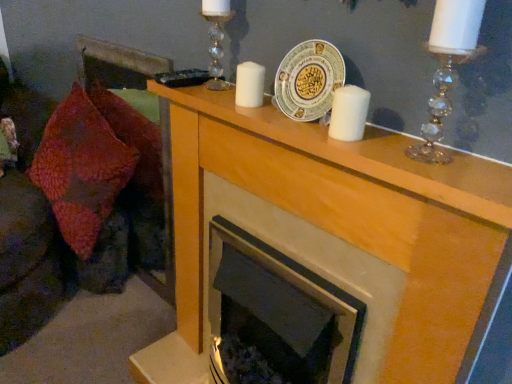
Question: Is white matte candle at center, the 2th candle positioned from the left, at the back of clear crystal candle holder at upper center, the 2th candle holder in the right-to-left sequence?

Choices:
 (A) no
 (B) yes

Answer: (A)

Question: From a real-world perspective, is clear crystal candle holder at upper center, acting as the 1th candle holder starting from the back, positioned over white matte candle at center, the 2th candle positioned from the left, based on gravity?

Choices:
 (A) no
 (B) yes

Answer: (B)

Question: Could white matte candle at center, the first candle ordered from the bottom, be considered to be inside clear crystal candle holder at upper center, the second candle holder viewed from the front?

Choices:
 (A) yes
 (B) no

Answer: (B)

Question: Considering the relative sizes of clear crystal candle holder at upper center, acting as the 1th candle holder starting from the back, and white matte candle at center, which ranks as the 2th candle in top-to-bottom order, in the image provided, is clear crystal candle holder at upper center, acting as the 1th candle holder starting from the back, wider than white matte candle at center, which ranks as the 2th candle in top-to-bottom order,?

Choices:
 (A) yes
 (B) no

Answer: (A)

Question: Can you confirm if clear crystal candle holder at upper center, the second candle holder viewed from the front, is taller than white matte candle at center, positioned as the first candle in right-to-left order?

Choices:
 (A) yes
 (B) no

Answer: (A)

Question: Is point (307, 79) positioned closer to the camera than point (364, 104)?

Choices:
 (A) closer
 (B) farther

Answer: (B)

Question: Considering the positions of white ceramic plate at center and white matte candle at center, positioned as the first candle in right-to-left order, in the image, is white ceramic plate at center bigger or smaller than white matte candle at center, positioned as the first candle in right-to-left order,?

Choices:
 (A) small
 (B) big

Answer: (B)

Question: Considering the positions of white ceramic plate at center and white matte candle at center, the 2th candle positioned from the left, in the image, is white ceramic plate at center wider or thinner than white matte candle at center, the 2th candle positioned from the left,?

Choices:
 (A) thin
 (B) wide

Answer: (B)

Question: In the image, is white ceramic plate at center positioned in front of or behind white matte candle at center, positioned as the first candle in right-to-left order?

Choices:
 (A) behind
 (B) front

Answer: (A)

Question: Looking at their shapes, would you say white matte candle at center, positioned as the first candle in right-to-left order, is wider or thinner than white matte candle at center, the second candle viewed from the front?

Choices:
 (A) thin
 (B) wide

Answer: (B)

Question: Does point (340, 87) appear closer or farther from the camera than point (257, 89)?

Choices:
 (A) closer
 (B) farther

Answer: (A)

Question: Considering the relative positions of white matte candle at center, which ranks as the 2th candle in top-to-bottom order, and white matte candle at center, which ranks as the first candle in top-to-bottom order, in the image provided, is white matte candle at center, which ranks as the 2th candle in top-to-bottom order, to the left or to the right of white matte candle at center, which ranks as the first candle in top-to-bottom order,?

Choices:
 (A) left
 (B) right

Answer: (B)

Question: Looking at the image, does white matte candle at center, which ranks as the 2th candle in top-to-bottom order, seem bigger or smaller compared to white matte candle at center, which is the first candle in left-to-right order?

Choices:
 (A) small
 (B) big

Answer: (B)

Question: Is clear crystal candle holder at upper right, which is counted as the 1th candle holder, starting from the front, inside the boundaries of wooden mantlepiece at upper center, or outside?

Choices:
 (A) outside
 (B) inside

Answer: (A)

Question: In the image, is clear crystal candle holder at upper right, positioned as the second candle holder in left-to-right order, positioned in front of or behind wooden mantlepiece at upper center?

Choices:
 (A) behind
 (B) front

Answer: (A)